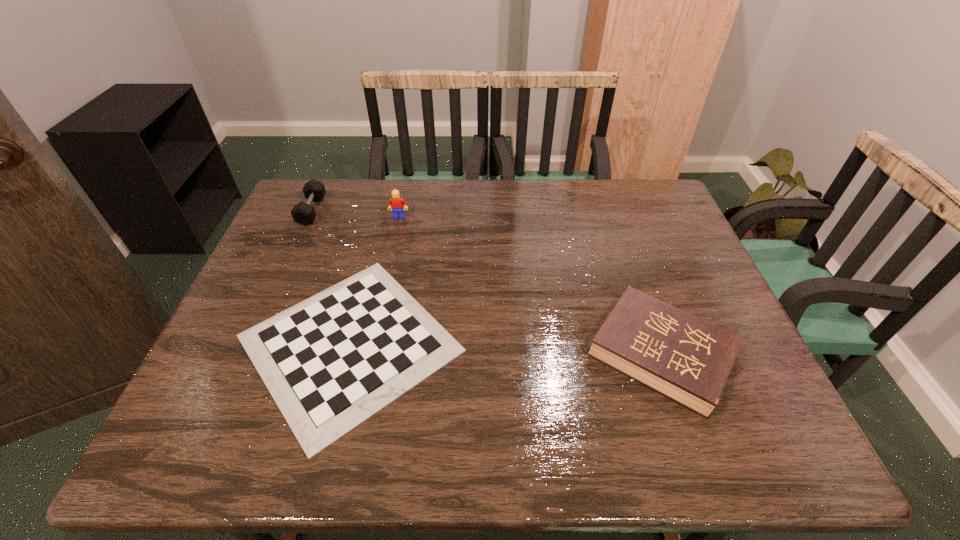
At what (x,y) coordinates should I click in order to perform the action: click on vacant space that satisfies the following two spatial constraints: 1. on the face of the third tallest object; 2. on the right side of the Lego. Please return your answer as a coordinate pair (x, y). Looking at the image, I should click on (370, 354).

Locate an element on the screen. The width and height of the screenshot is (960, 540). free space that satisfies the following two spatial constraints: 1. on the face of the tallest object; 2. on the left side of the hardback book is located at coordinates (370, 354).